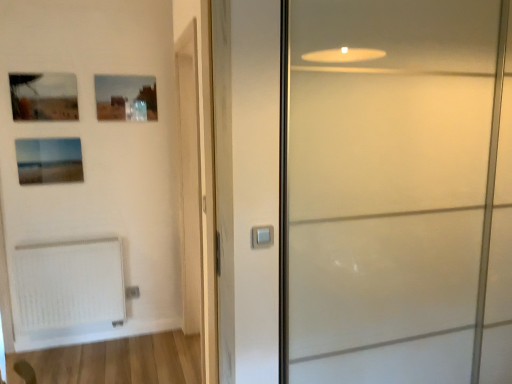
Locate an element on the screen. Image resolution: width=512 pixels, height=384 pixels. free space underneath white textured radiator at lower left (from a real-world perspective) is located at coordinates (73, 345).